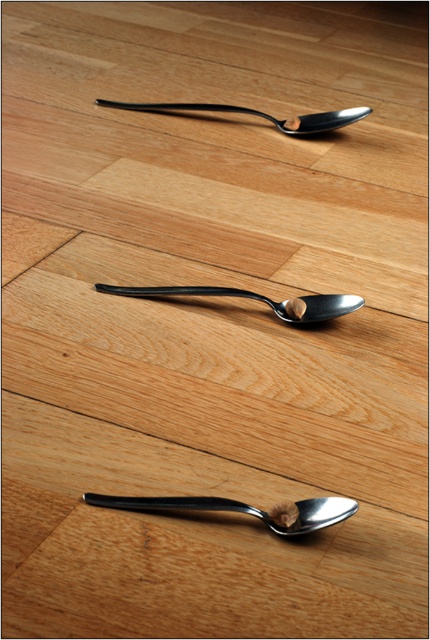
Question: From the image, what is the correct spatial relationship of polished metal spoon at center in relation to satin black spoon at center?

Choices:
 (A) left
 (B) right

Answer: (A)

Question: Estimate the real-world distances between objects in this image. Which object is closer to the polished metal spoon at center?

Choices:
 (A) polished metal spoon at upper center
 (B) satin black spoon at center

Answer: (B)

Question: Is satin black spoon at center positioned before polished metal spoon at upper center?

Choices:
 (A) no
 (B) yes

Answer: (B)

Question: Among these objects, which one is nearest to the camera?

Choices:
 (A) satin black spoon at center
 (B) polished metal spoon at upper center

Answer: (A)

Question: Observing the image, what is the correct spatial positioning of satin black spoon at center in reference to polished metal spoon at upper center?

Choices:
 (A) right
 (B) left

Answer: (A)

Question: Which object is farther from the camera taking this photo?

Choices:
 (A) polished metal spoon at upper center
 (B) satin black spoon at center
 (C) polished metal spoon at center

Answer: (A)